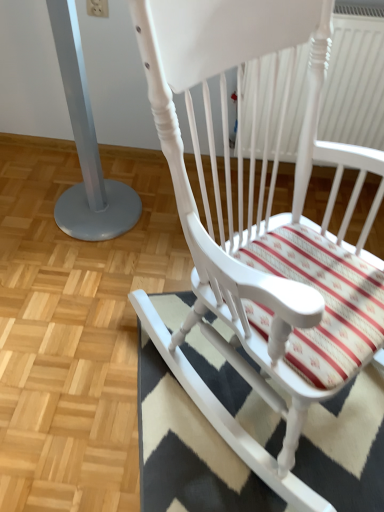
Identify the location of vacant area located to the right-hand side of silver metallic pole at left. Image resolution: width=384 pixels, height=512 pixels. (162, 220).